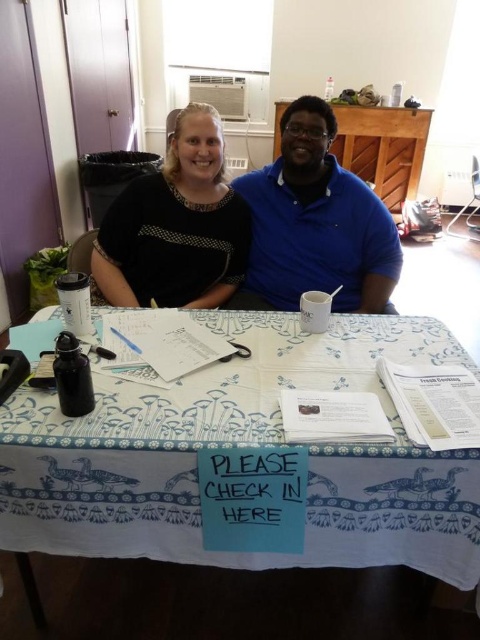
You are organizing a small event and need to place a name tag on the table. The name tag is 10 cm wide. Can the white printed fabric at center accommodate the name tag without overlapping the black dotted shirt at upper left?

The white printed fabric at center might be wider than black dotted shirt at upper left, so it could potentially accommodate the name tag. However, since the exact width isn not specified, it is advisable to check the actual dimensions before placing the name tag.

Consider the image. You are organizing a small event and need to place a name tag on the table. The name tag is the same size as the black dotted shirt at upper left. Will it fit on the white printed fabric at center without overlapping the edges?

The white printed fabric at center is larger in size than the black dotted shirt at upper left, so the name tag will fit on the white printed fabric at center without overlapping the edges.